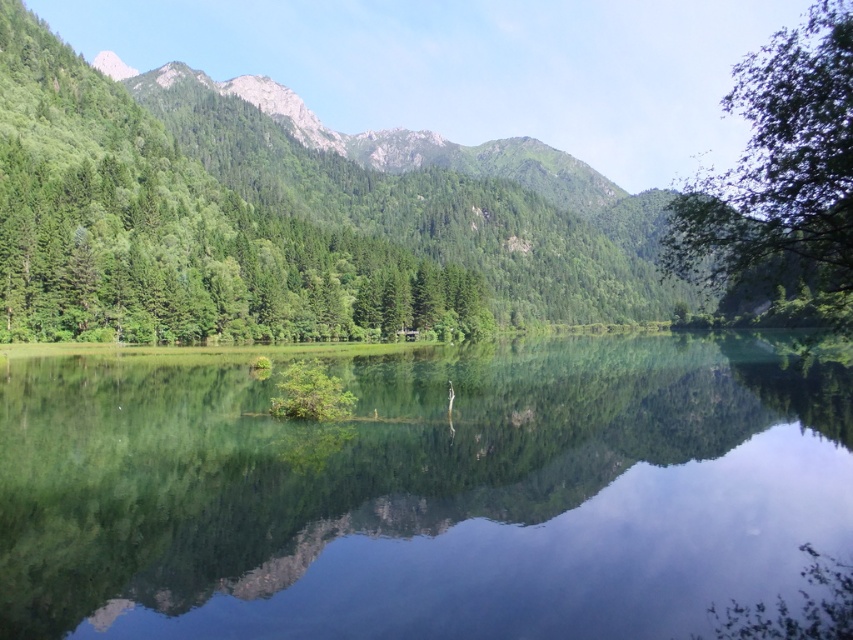
You are standing at the edge of the lake in the scene. There is a point marked at coordinates (422, 492) which corresponds to a location on the green reflective water at center. If you want to reach this point, which direction should you walk from your current position at the lake edge?

The point marked at coordinates (422, 492) corresponds to the green reflective water at center. Since you are at the lake edge, you should walk towards the center of the lake to reach this point.

You are an artist planning to paint the scene. You notice the green reflective water at center and the green matte tree at left. Which object should you focus on first if you want to paint the larger area first?

The green matte tree at left occupies more space than the green reflective water at center, so you should focus on painting the green matte tree at left first.